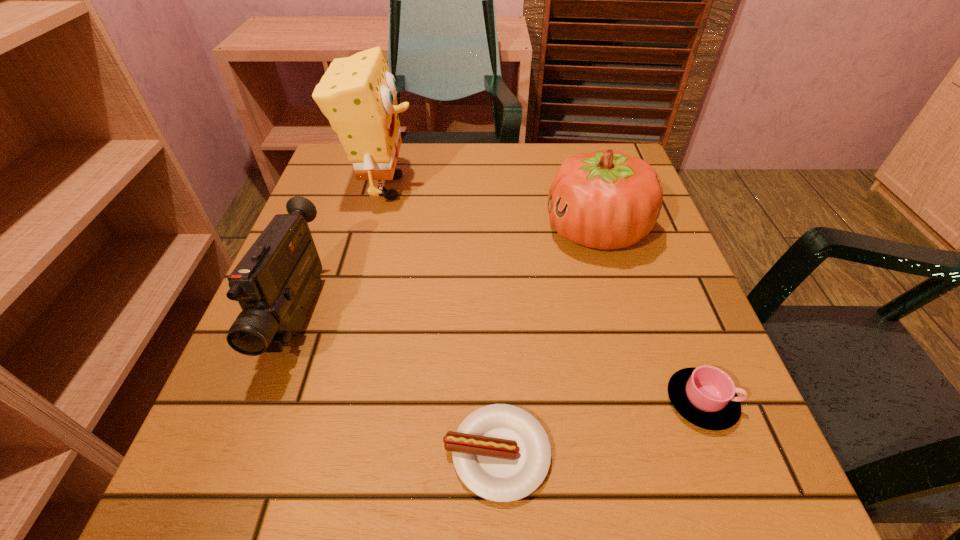
I want to click on free space at the near edge, so tap(553, 450).

Identify the location of vacant space at the left edge of the desktop. (x=324, y=296).

Identify the location of vacant region at the right edge of the desktop. This screenshot has height=540, width=960. (611, 281).

Find the location of a particular element. The width and height of the screenshot is (960, 540). free space at the near left corner is located at coordinates (181, 519).

The image size is (960, 540). In order to click on free space between the cup and the pumpkin in this screenshot , I will do `click(649, 316)`.

Find the location of a particular element. The height and width of the screenshot is (540, 960). empty space between the third object from left to right and the pumpkin is located at coordinates (546, 342).

The width and height of the screenshot is (960, 540). I want to click on blank region between the fourth tallest object and the tallest object, so click(542, 294).

Where is `blank region between the sponge and the fourth tallest object`? The image size is (960, 540). blank region between the sponge and the fourth tallest object is located at coordinates (542, 294).

The image size is (960, 540). In order to click on free space between the camcorder and the pumpkin in this screenshot , I will do `click(447, 274)`.

The width and height of the screenshot is (960, 540). What are the coordinates of `free space that is in between the third object from left to right and the tallest object` in the screenshot? It's located at (441, 320).